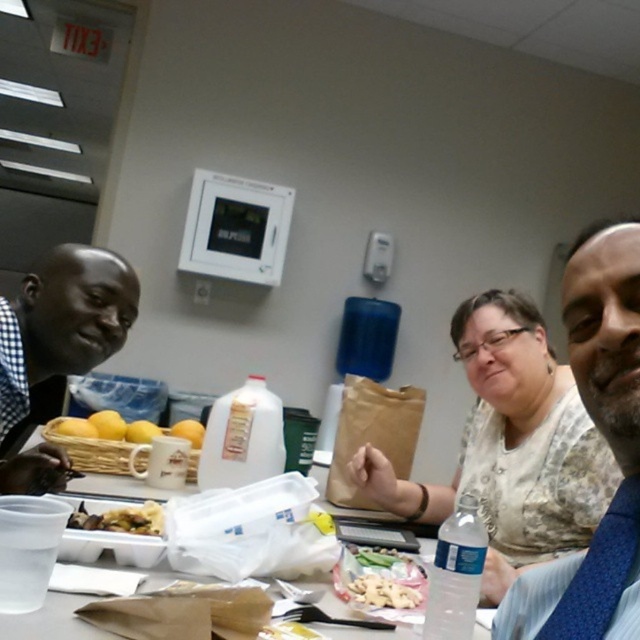
Question: Estimate the real-world distances between objects in this image. Which object is farther from the white plastic table at center?

Choices:
 (A) brown crumbly at center
 (B) matte black shirt at left
 (C) white crumbly pastry at center
 (D) blue fabric tie at right

Answer: (D)

Question: Can you confirm if matte black shirt at left is positioned to the right of blue fabric tie at right?

Choices:
 (A) yes
 (B) no

Answer: (B)

Question: Which point is closer to the camera taking this photo?

Choices:
 (A) (534, 477)
 (B) (404, 602)
 (C) (588, 632)
 (D) (136, 486)

Answer: (C)

Question: Is yellow matte lemons at center to the right of white plastic table at center from the viewer's perspective?

Choices:
 (A) yes
 (B) no

Answer: (B)

Question: Can you confirm if white plastic table at center is positioned below brown crumbly at center?

Choices:
 (A) no
 (B) yes

Answer: (B)

Question: Estimate the real-world distances between objects in this image. Which object is closer to the blue fabric tie at right?

Choices:
 (A) blue textured shirt at right
 (B) white crumbly pastry at center
 (C) white plastic table at center
 (D) brown crumbly at center

Answer: (A)